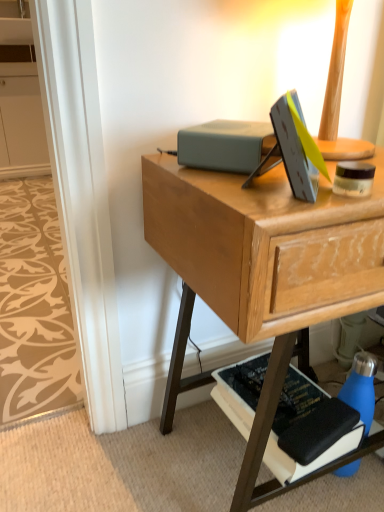
Question: Is the depth of blue matte water bottle at lower right greater than that of beige patterned carpet at lower left?

Choices:
 (A) yes
 (B) no

Answer: (B)

Question: Is blue matte water bottle at lower right placed right next to beige patterned carpet at lower left?

Choices:
 (A) yes
 (B) no

Answer: (B)

Question: Considering the relative sizes of blue matte water bottle at lower right and beige patterned carpet at lower left in the image provided, is blue matte water bottle at lower right taller than beige patterned carpet at lower left?

Choices:
 (A) yes
 (B) no

Answer: (A)

Question: Does blue matte water bottle at lower right have a smaller size compared to beige patterned carpet at lower left?

Choices:
 (A) no
 (B) yes

Answer: (B)

Question: From the image's perspective, would you say blue matte water bottle at lower right is shown under beige patterned carpet at lower left?

Choices:
 (A) yes
 (B) no

Answer: (A)

Question: From a real-world perspective, does blue matte water bottle at lower right stand above beige patterned carpet at lower left?

Choices:
 (A) yes
 (B) no

Answer: (A)

Question: Considering the relative sizes of matte gray book at center, which is counted as the first paperback book, starting from the top, and white matte cabinet at upper left in the image provided, is matte gray book at center, which is counted as the first paperback book, starting from the top, shorter than white matte cabinet at upper left?

Choices:
 (A) yes
 (B) no

Answer: (A)

Question: Can you confirm if matte gray book at center, which is counted as the first paperback book, starting from the top, is bigger than white matte cabinet at upper left?

Choices:
 (A) no
 (B) yes

Answer: (A)

Question: Is matte gray book at center, which is counted as the first paperback book, starting from the top, smaller than white matte cabinet at upper left?

Choices:
 (A) yes
 (B) no

Answer: (A)

Question: Is matte gray book at center, positioned as the 2th paperback book in bottom-to-top order, turned away from white matte cabinet at upper left?

Choices:
 (A) yes
 (B) no

Answer: (B)

Question: From a real-world perspective, is matte gray book at center, which is counted as the first paperback book, starting from the top, on top of white matte cabinet at upper left?

Choices:
 (A) no
 (B) yes

Answer: (B)

Question: Considering the relative sizes of matte gray book at center, which is counted as the first paperback book, starting from the top, and white matte cabinet at upper left in the image provided, is matte gray book at center, which is counted as the first paperback book, starting from the top, wider than white matte cabinet at upper left?

Choices:
 (A) no
 (B) yes

Answer: (A)

Question: Considering the relative positions of blue matte water bottle at lower right and matte gray book at center, which is counted as the first paperback book, starting from the top, in the image provided, is blue matte water bottle at lower right to the left of matte gray book at center, which is counted as the first paperback book, starting from the top, from the viewer's perspective?

Choices:
 (A) yes
 (B) no

Answer: (B)